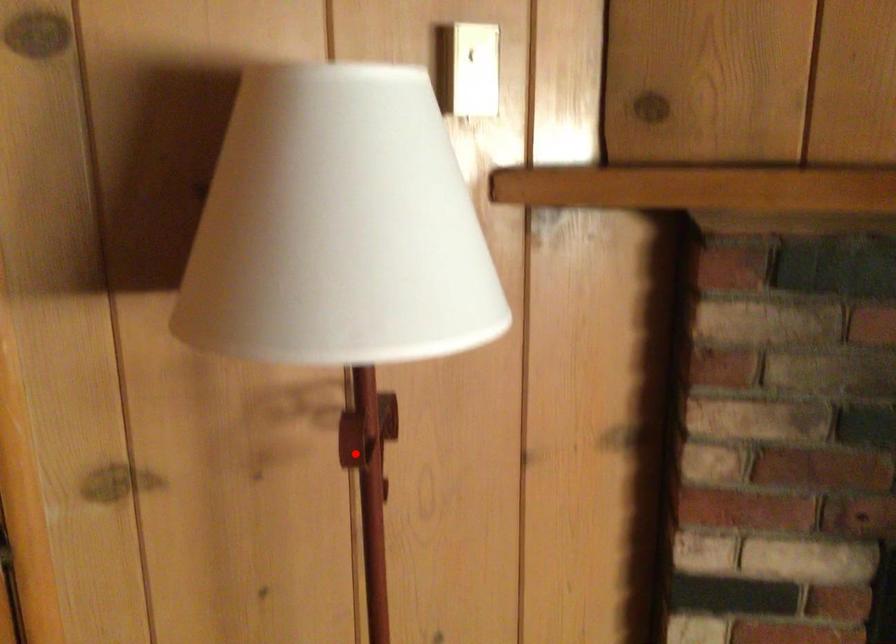
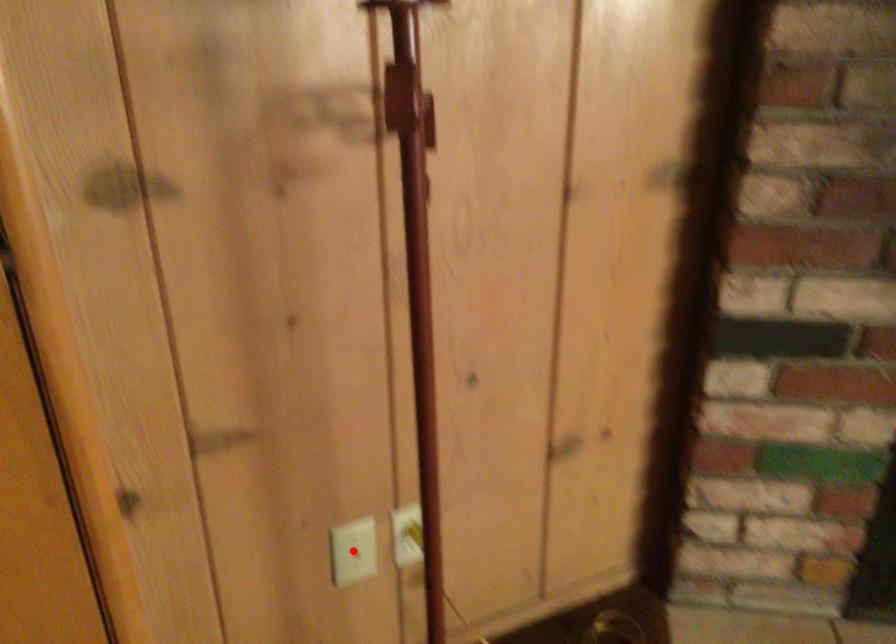
I am providing you with two images of the same scene from different viewpoints. A red point is marked on the first image and another point is marked on the second image. Is the marked point in image1 the same physical position as the marked point in image2?

No